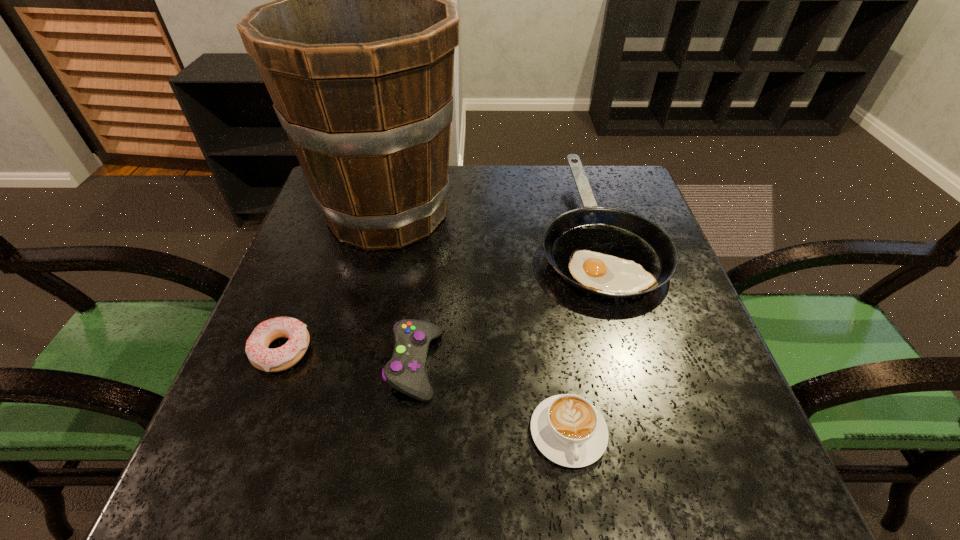
Locate an element on the screen. The image size is (960, 540). vacant space at the right edge of the desktop is located at coordinates (705, 346).

This screenshot has height=540, width=960. I want to click on vacant space at the near left corner, so click(x=223, y=454).

In the image, there is a desktop. At what (x,y) coordinates should I click in order to perform the action: click on free space at the near right corner. Please return your answer as a coordinate pair (x, y). The width and height of the screenshot is (960, 540). Looking at the image, I should click on (723, 483).

Image resolution: width=960 pixels, height=540 pixels. Find the location of `free area in between the frying pan and the bucket`. free area in between the frying pan and the bucket is located at coordinates (492, 221).

Image resolution: width=960 pixels, height=540 pixels. Identify the location of free space between the doughnut and the tallest object. (335, 281).

Find the location of a particular element. free area in between the doughnut and the bucket is located at coordinates (335, 281).

Identify the location of free spot between the bucket and the control. (401, 288).

Locate an element on the screen. free space between the tallest object and the control is located at coordinates (401, 288).

Find the location of `vacant area between the frying pan and the cappuccino`. vacant area between the frying pan and the cappuccino is located at coordinates (582, 332).

Locate an element on the screen. The width and height of the screenshot is (960, 540). vacant point located between the frying pan and the doughnut is located at coordinates (439, 291).